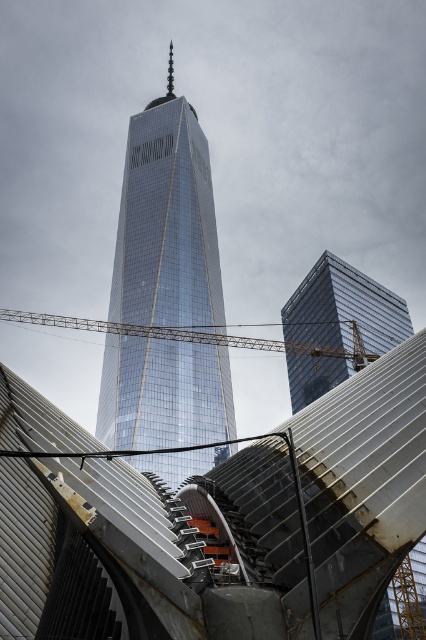
You are a construction worker standing at the base of the metallic silver structure at center and the metallic yellow crane at center. Which object is closer to you?

The metallic silver structure at center is closer to the viewer than the metallic yellow crane at center, so the metallic silver structure at center is closer to you.

You are a construction worker standing at the base of the metallic yellow crane at center. You need to move to the metallic silver structure at center. Which direction should you walk to reach it?

The metallic silver structure at center is to the right of the metallic yellow crane at center, so you should walk to the right to reach it.

You are standing in front of the skyscraper and notice two points marked in the image. Which point, point (x=321, y=627) or point (x=317, y=349), is closer to your eyes?

Point (x=321, y=627) is closer to the camera than point (x=317, y=349).